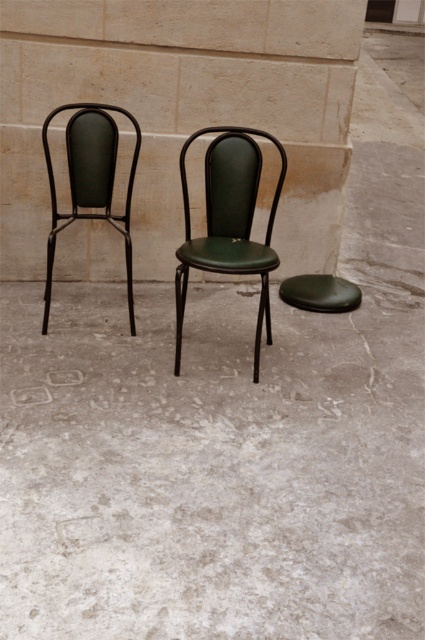
Question: Can you confirm if green leather chair at center is wider than green leather stool at center?

Choices:
 (A) no
 (B) yes

Answer: (B)

Question: Which point is farther to the camera?

Choices:
 (A) click(337, 310)
 (B) click(229, 163)

Answer: (A)

Question: Is green leather chair at center positioned behind green matte chair at left?

Choices:
 (A) yes
 (B) no

Answer: (B)

Question: Does green leather chair at center have a larger size compared to green leather stool at center?

Choices:
 (A) no
 (B) yes

Answer: (B)

Question: Which object is farther from the camera taking this photo?

Choices:
 (A) green leather chair at center
 (B) green matte chair at left
 (C) green leather stool at center

Answer: (C)

Question: Among these points, which one is farthest from the camera?

Choices:
 (A) (87, 198)
 (B) (351, 307)
 (C) (266, 323)

Answer: (B)